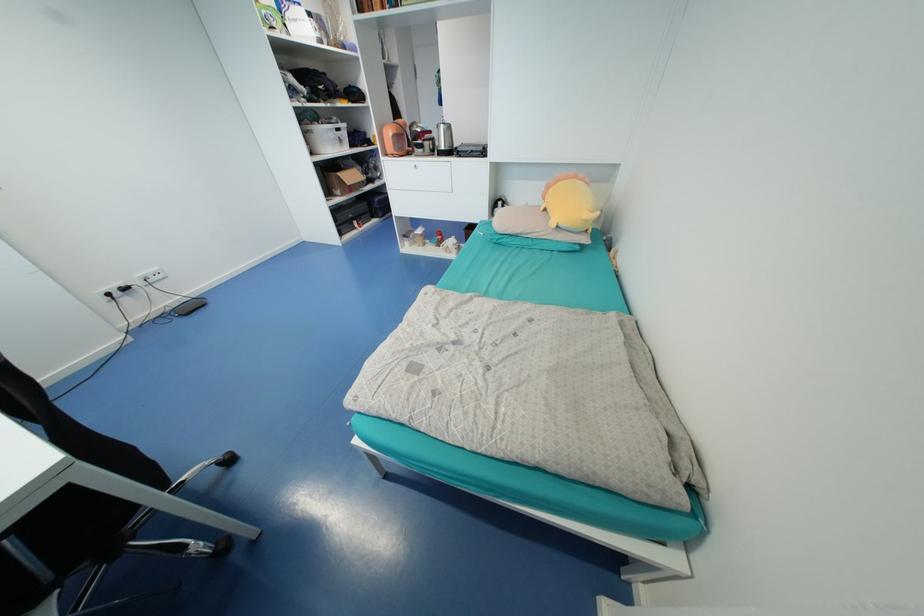
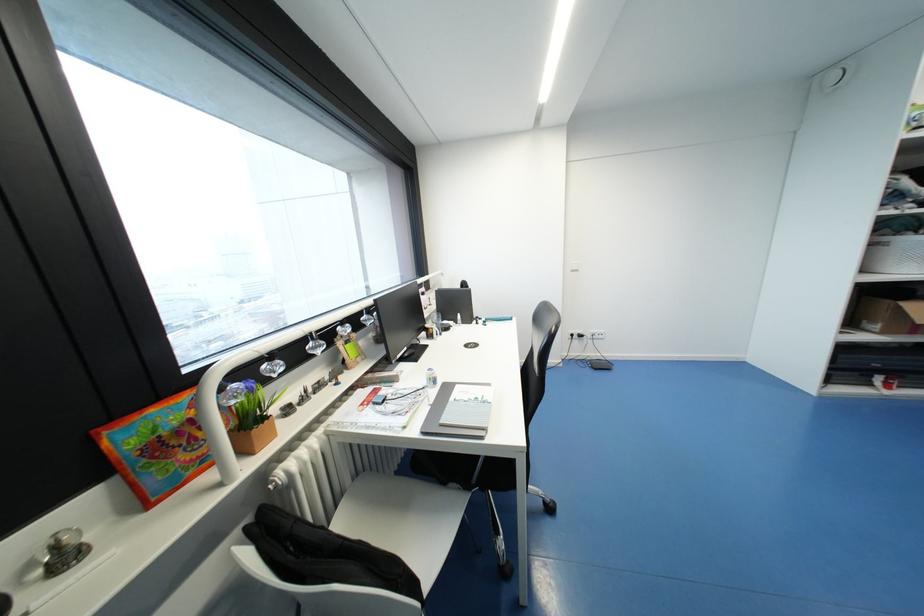
Question: How did the camera likely rotate?

Choices:
 (A) Left
 (B) Right
 (C) Up
 (D) Down

Answer: (A)